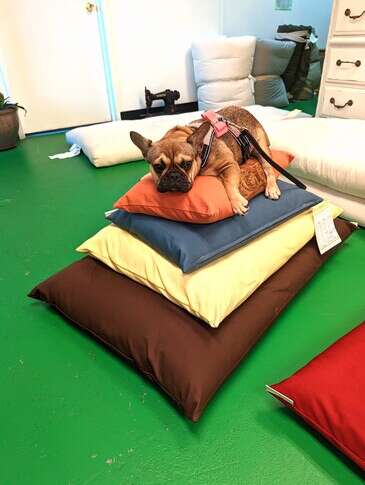
I want to click on dresser, so click(x=343, y=49).